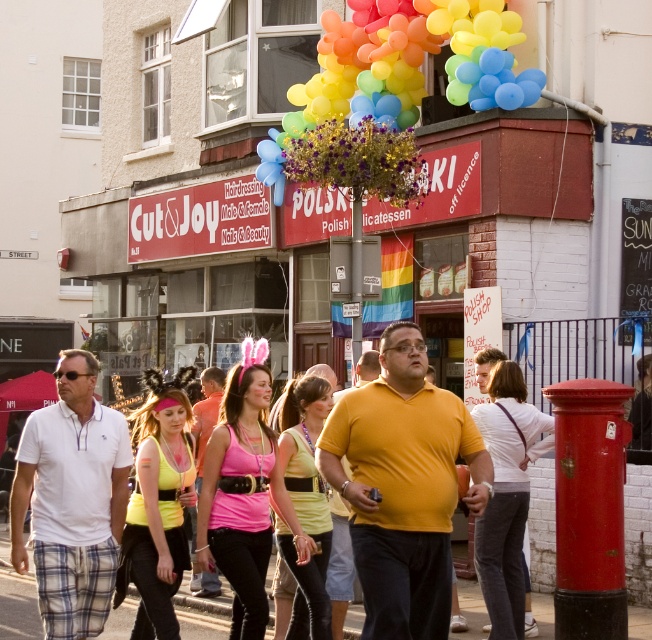
Question: Can you confirm if concrete pavement at center is smaller than pink fabric top at center?

Choices:
 (A) yes
 (B) no

Answer: (B)

Question: Which object is farther from the camera taking this photo?

Choices:
 (A) white cotton polo shirt at center
 (B) concrete pavement at center

Answer: (B)

Question: Which point is farther from the camera taking this photo?

Choices:
 (A) (134, 588)
 (B) (215, 579)

Answer: (A)

Question: Can you confirm if white cotton polo shirt at center is positioned below neon yellow fabric at center?

Choices:
 (A) no
 (B) yes

Answer: (A)

Question: Does yellow matte shirt at center appear over rainbow balloons at upper center?

Choices:
 (A) no
 (B) yes

Answer: (A)

Question: Which object is farther from the camera taking this photo?

Choices:
 (A) white jersey at center
 (B) concrete pavement at center

Answer: (B)